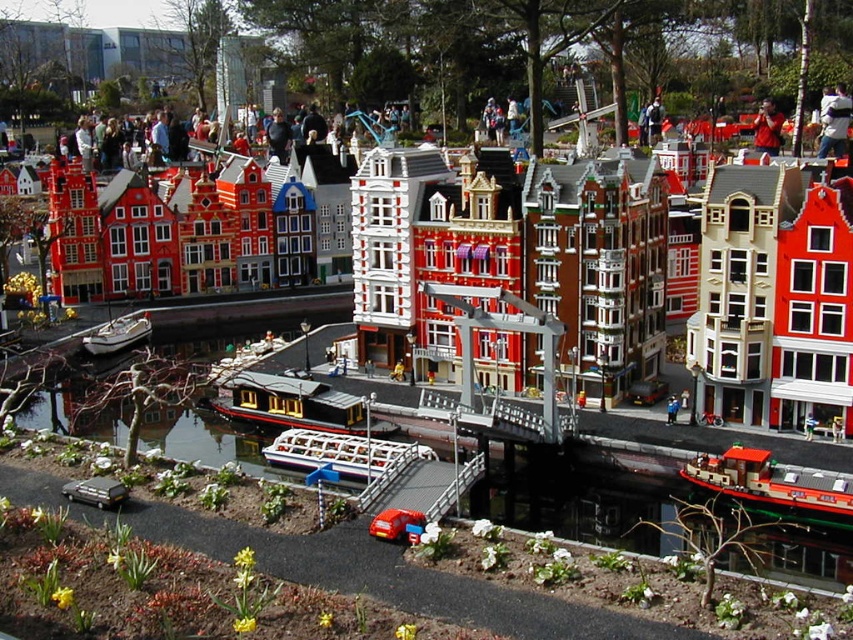
Question: From the image, what is the correct spatial relationship of clear plastic water at center in relation to white plastic boat at center?

Choices:
 (A) above
 (B) below

Answer: (A)

Question: Is the position of white plastic boat at center-left more distant than that of reddish-brown leather jacket at upper right?

Choices:
 (A) no
 (B) yes

Answer: (A)

Question: Which object is closer to the camera taking this photo?

Choices:
 (A) clear plastic water at center
 (B) white plastic boat at center
 (C) wooden houseboat at center

Answer: (A)

Question: Is white plastic boat at center-left bigger than reddish-brown leather jacket at upper right?

Choices:
 (A) yes
 (B) no

Answer: (B)

Question: Which object is positioned closest to the reddish-brown leather jacket at upper right?

Choices:
 (A) clear plastic water at center
 (B) blue fabric person at center

Answer: (A)

Question: Which point is farther from the camera taking this photo?

Choices:
 (A) (274, 417)
 (B) (764, 148)
 (C) (96, 339)

Answer: (B)